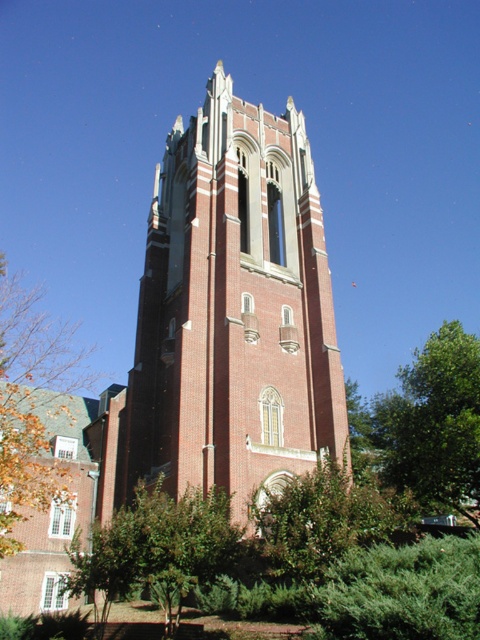
Who is lower down, green leafy tree at right or brown leafy tree at left?

Positioned lower is green leafy tree at right.

Which is above, green leafy tree at right or brown leafy tree at left?

brown leafy tree at left is higher up.

Who is more distant from viewer, (472, 436) or (68, 397)?

Positioned behind is point (68, 397).

The height and width of the screenshot is (640, 480). I want to click on green leafy tree at right, so click(x=433, y=422).

Can you confirm if brick tower at center is positioned below green leafy tree at right?

No, brick tower at center is not below green leafy tree at right.

Does brick tower at center appear over green leafy tree at right?

Yes, brick tower at center is above green leafy tree at right.

Where is `brick tower at center`? This screenshot has height=640, width=480. brick tower at center is located at coordinates (229, 314).

Is brick tower at center thinner than brown leafy tree at left?

Indeed, brick tower at center has a lesser width compared to brown leafy tree at left.

Can you confirm if brick tower at center is taller than brown leafy tree at left?

Yes.

You are a GUI agent. You are given a task and a screenshot of the screen. Output one action in this format:
    pyautogui.click(x=<x>, y=<y>)
    Task: Click on the brick tower at center
    This screenshot has width=480, height=640.
    Given the screenshot: What is the action you would take?
    pyautogui.click(x=229, y=314)

Image resolution: width=480 pixels, height=640 pixels. Identify the location of brick tower at center. (229, 314).